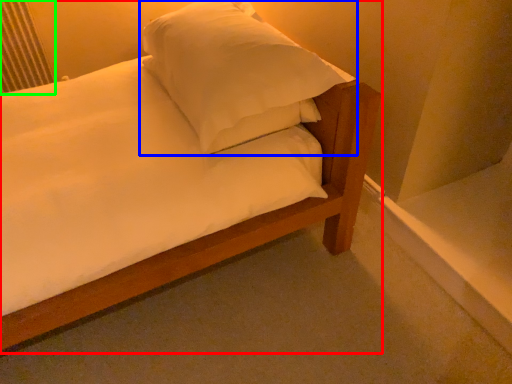
Question: Based on their relative distances, which object is nearer to bed (highlighted by a red box)? Choose from pillow (highlighted by a blue box) and radiator (highlighted by a green box).

Choices:
 (A) pillow
 (B) radiator

Answer: (A)